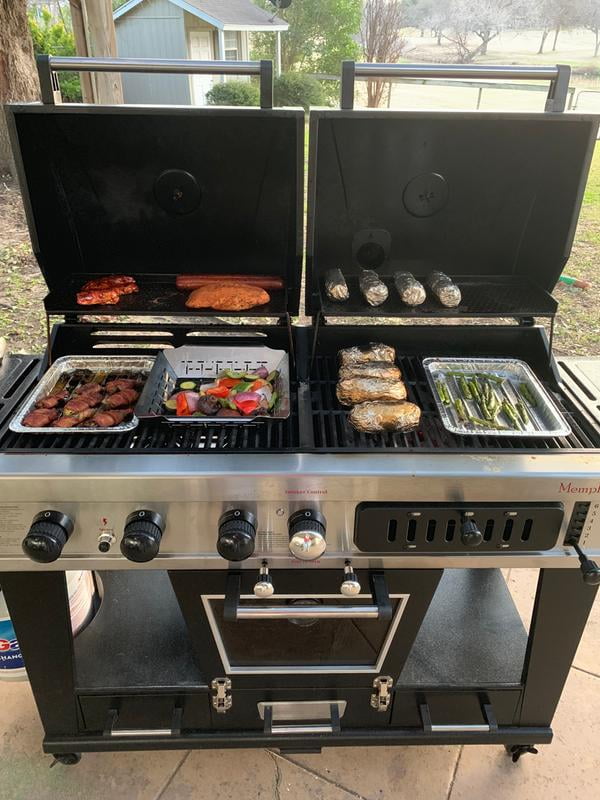
At what (x,y) coordinates should I click in order to perform the action: click on knob. Please return your answer as a coordinate pair (x, y). Looking at the image, I should click on (592, 574).